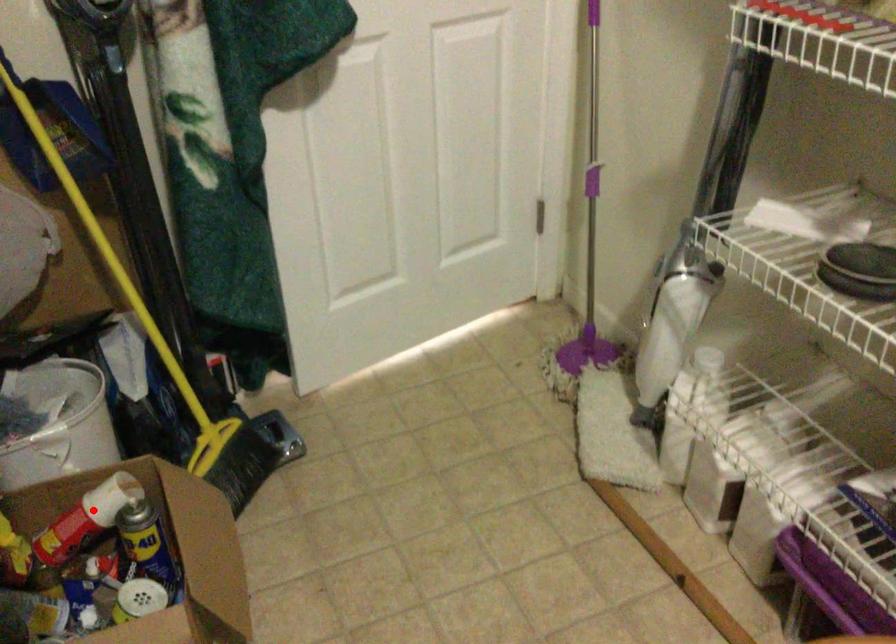
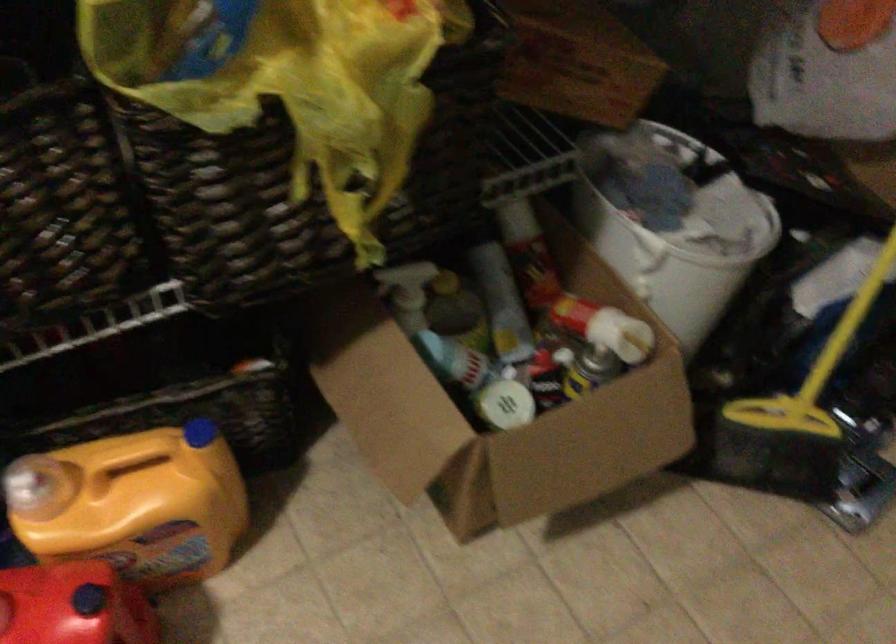
Find the pixel in the second image that matches the highlighted location in the first image.

(595, 319)